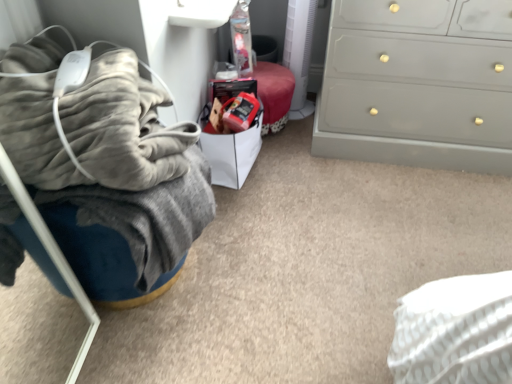
Question: Is white paper bag at center facing away from velvety gray blanket at left?

Choices:
 (A) no
 (B) yes

Answer: (A)

Question: Is white paper bag at center aimed at velvety gray blanket at left?

Choices:
 (A) yes
 (B) no

Answer: (B)

Question: Would you say white paper bag at center is outside velvety gray blanket at left?

Choices:
 (A) no
 (B) yes

Answer: (B)

Question: Does white paper bag at center have a lesser height compared to velvety gray blanket at left?

Choices:
 (A) no
 (B) yes

Answer: (A)

Question: Is the position of white paper bag at center less distant than that of velvety gray blanket at left?

Choices:
 (A) yes
 (B) no

Answer: (B)

Question: Considering the positions of white paper bag at center and velvety gray blanket at left in the image, is white paper bag at center taller or shorter than velvety gray blanket at left?

Choices:
 (A) tall
 (B) short

Answer: (A)

Question: Considering their positions, is white paper bag at center located in front of or behind velvety gray blanket at left?

Choices:
 (A) behind
 (B) front

Answer: (A)

Question: Would you say white paper bag at center is to the left or to the right of velvety gray blanket at left in the picture?

Choices:
 (A) right
 (B) left

Answer: (A)

Question: In terms of width, does white paper bag at center look wider or thinner when compared to velvety gray blanket at left?

Choices:
 (A) wide
 (B) thin

Answer: (B)

Question: Visually, is white paper bag at center positioned to the left or to the right of matte gray dresser at right?

Choices:
 (A) right
 (B) left

Answer: (B)

Question: Which is correct: white paper bag at center is inside matte gray dresser at right, or outside of it?

Choices:
 (A) inside
 (B) outside

Answer: (B)

Question: Is point (216, 140) positioned closer to the camera than point (390, 54)?

Choices:
 (A) closer
 (B) farther

Answer: (B)

Question: Is white paper bag at center bigger or smaller than matte gray dresser at right?

Choices:
 (A) small
 (B) big

Answer: (A)

Question: Considering their positions, is matte gray dresser at right located in front of or behind white paper bag at center?

Choices:
 (A) behind
 (B) front

Answer: (B)

Question: From the image's perspective, is matte gray dresser at right above or below white paper bag at center?

Choices:
 (A) below
 (B) above

Answer: (B)